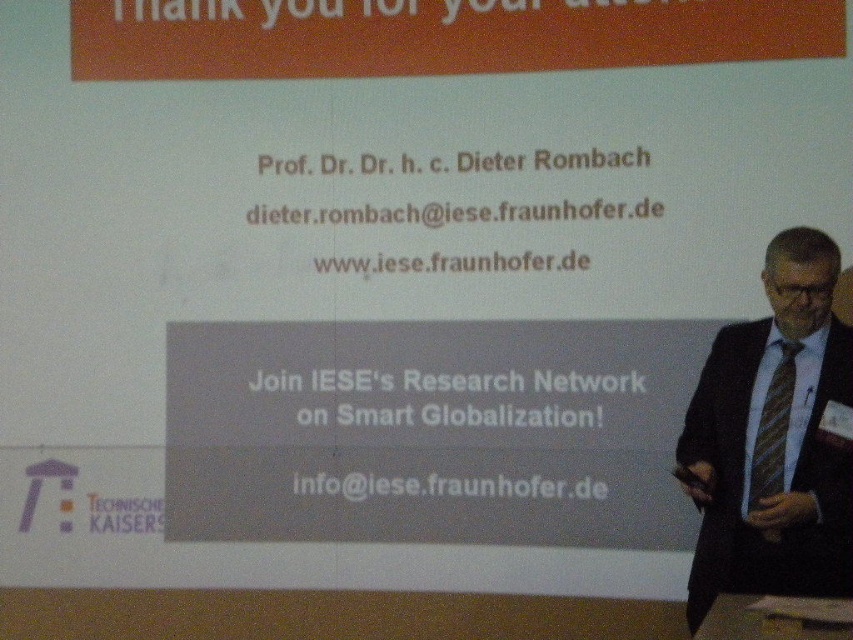
From the picture: You are attending a formal event and notice the black suit at right and the striped fabric tie at right. Which one is higher in the image?

The black suit at right is taller than the striped fabric tie at right.

What is the position of the black suit at right in the image?

The black suit at right is located at point 0.688 along the horizontal axis and 0.907 along the vertical axis.

You are attending a formal event and notice the black suit at right and the striped fabric tie at right. Based on their positions, which one is closer to the bottom of the frame?

The black suit at right is located below the striped fabric tie at right, so it is closer to the bottom of the frame.